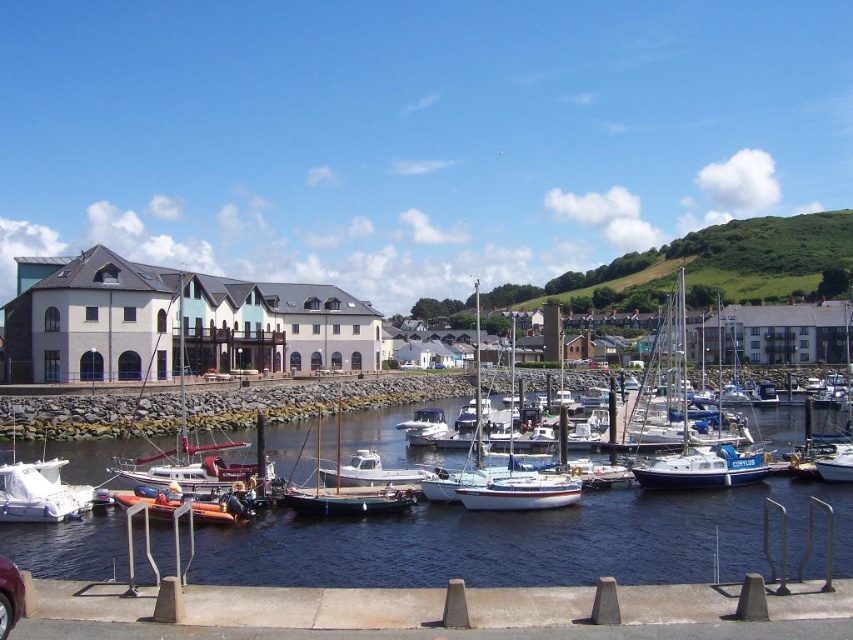
You are a dock attendant who needs to arrange the blue matte sailboat at center and the orange rubber dinghy at lower left side by side on a 3 meter wide dock. Can both fit without overlapping?

The blue matte sailboat at center might be wider than orange rubber dinghy at lower left. If the sailboat is wider, the combined width of both might exceed 3 meters, so they may not fit. If the sailboat is not wider, they could fit.